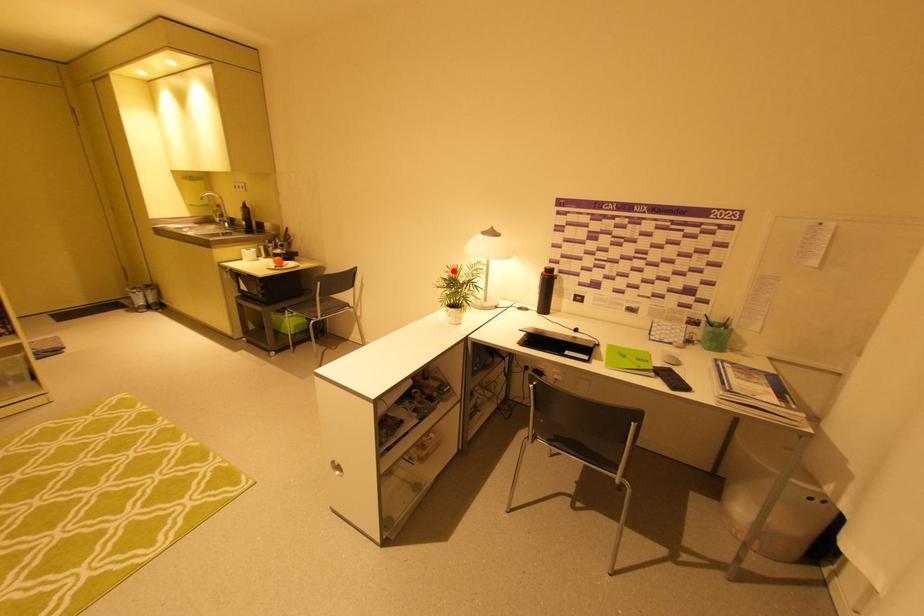
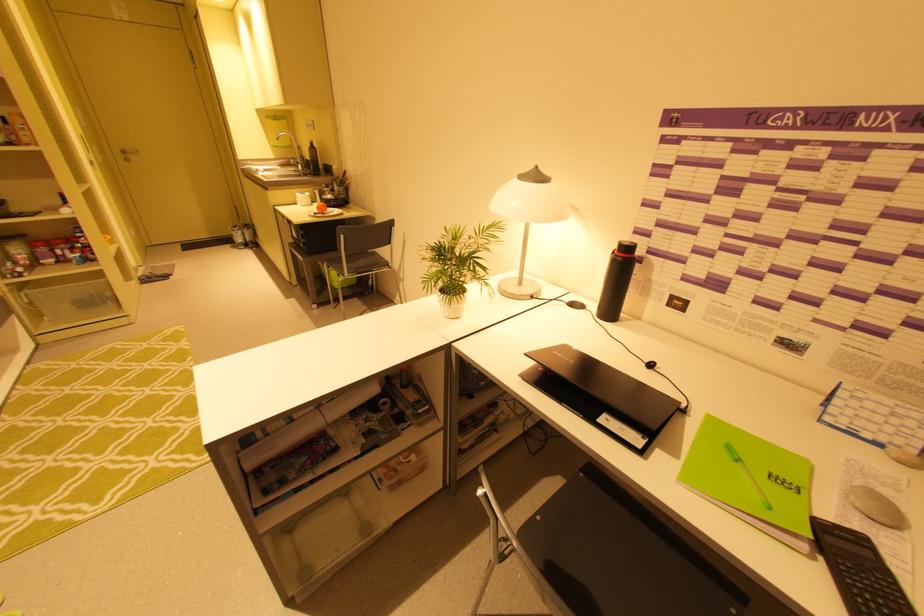
Locate, in the second image, the point that corresponds to the highlighted location in the first image.

(451, 235)